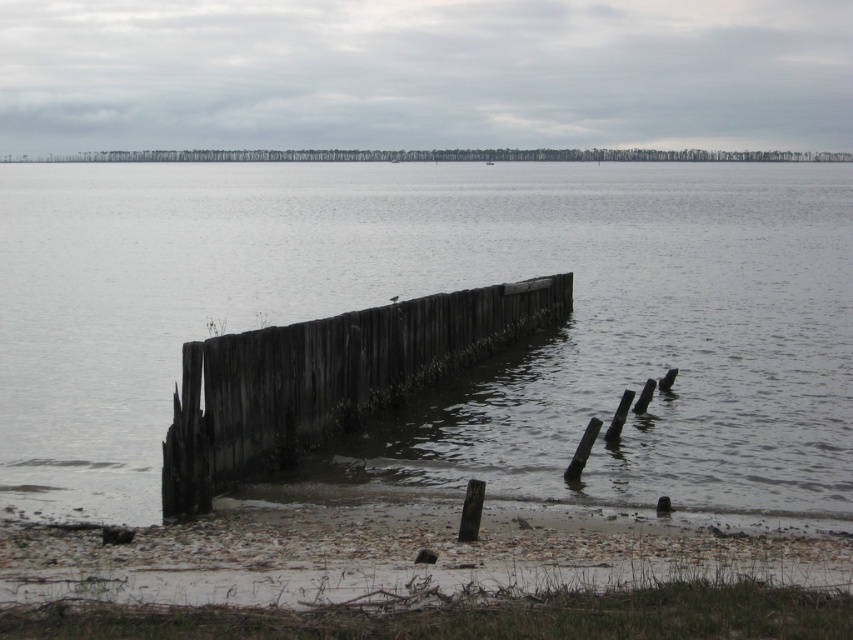
Question: Estimate the real-world distances between objects in this image. Which object is farther from the weathered wood water at center?

Choices:
 (A) smooth sand shoreline at lower center
 (B) weathered wood dock at center

Answer: (A)

Question: Which point is farther from the camera taking this photo?

Choices:
 (A) (256, 452)
 (B) (672, 193)

Answer: (B)

Question: Considering the relative positions of smooth sand shoreline at lower center and weathered wood dock at center in the image provided, where is smooth sand shoreline at lower center located with respect to weathered wood dock at center?

Choices:
 (A) left
 (B) right

Answer: (A)

Question: Considering the relative positions of weathered wood water at center and weathered wood dock at center in the image provided, where is weathered wood water at center located with respect to weathered wood dock at center?

Choices:
 (A) left
 (B) right

Answer: (A)

Question: Does weathered wood water at center have a lesser width compared to smooth sand shoreline at lower center?

Choices:
 (A) yes
 (B) no

Answer: (B)

Question: Estimate the real-world distances between objects in this image. Which object is closer to the weathered wood dock at center?

Choices:
 (A) weathered wood water at center
 (B) smooth sand shoreline at lower center

Answer: (B)